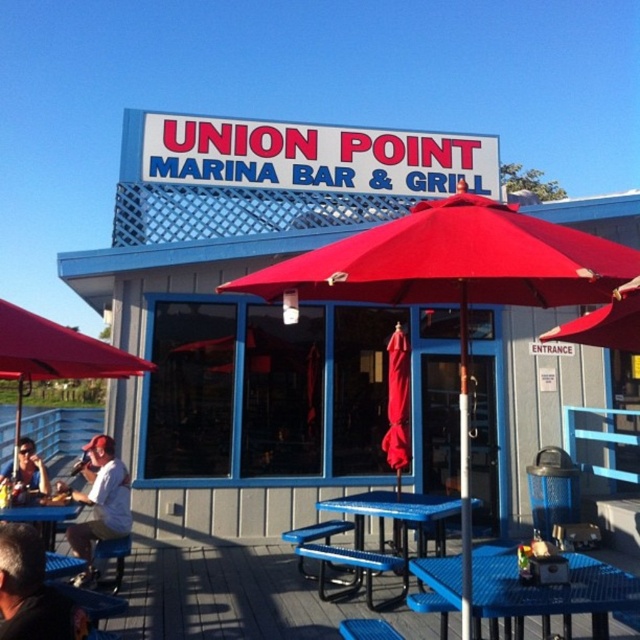
You are a customer sitting at the gray hair at lower left. Can you see the sign above the entrance of Union Point Marina Bar Grill from your current position under the red fabric umbrella at left?

Yes, the red fabric umbrella at left is positioned over gray hair at lower left, so the customer can see the sign above the entrance as the umbrella does not block the view.

You are a customer waiting to be seated at Union Point Marina Bar and Grill. You see a gray hair at lower left and a blue plastic table at lower left. How far apart are these two items?

The gray hair at lower left is 3.26 meters from blue plastic table at lower left.

You are a customer at Union Point Marina Bar and Grill. You notice a gray hair at lower left and a blue plastic table at lower left. Which object is closer to the ground?

The gray hair at lower left is shorter than the blue plastic table at lower left, so the gray hair at lower left is closer to the ground.